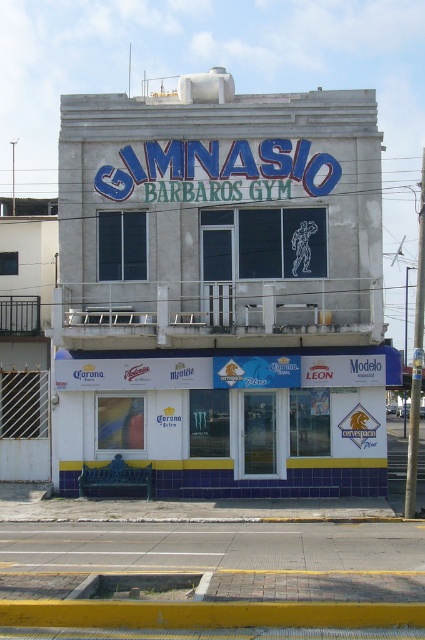
In the scene shown: You are standing at the entrance of the building and want to sit on the blue tile bench at lower center. Based on the coordinates provided, in which direction should you walk from the entrance to reach the bench?

The blue tile bench at lower center is located at coordinates point (229, 419), which is towards the lower center area of the building. Since you are at the entrance, you should walk towards the lower center direction to reach the bench.

You are a delivery person who needs to park your van in front of the building. The van requires a space that can accommodate a large vehicle. Based on the image, which object can you use as a reference to determine if the parking space in front of the white concrete building at center and the blue tile bench at lower center is suitable?

The white concrete building at center is larger in size than the blue tile bench at lower center. Since the van needs a large space, you can use the size of the white concrete building at center as a reference to estimate if the parking space in front is suitable for a large vehicle.